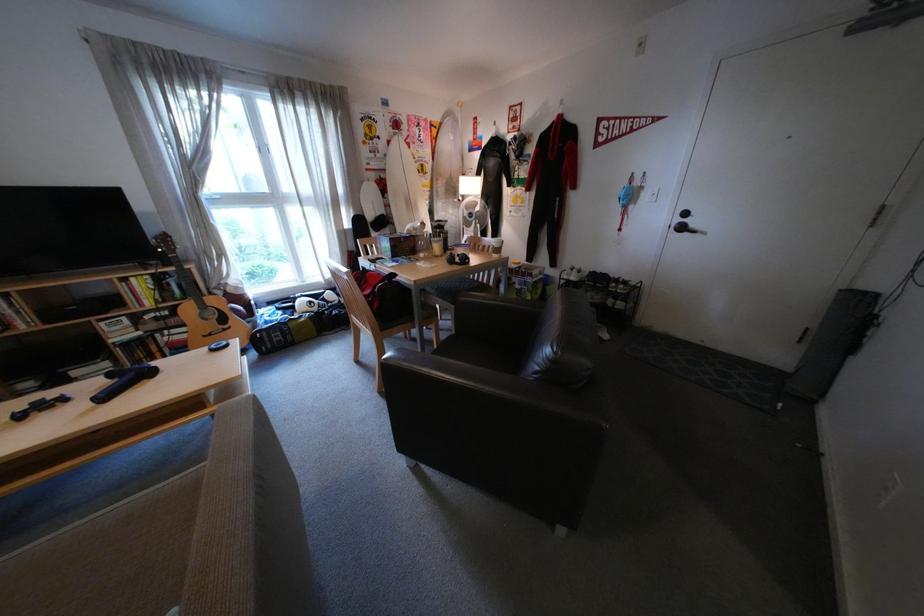
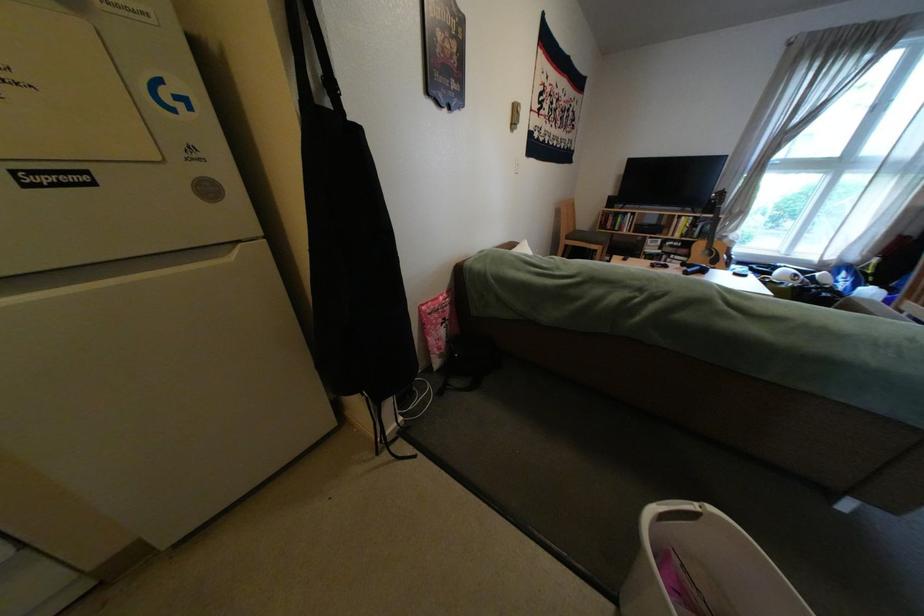
Locate, in the second image, the point that corresponds to the point at 184,336 in the first image.

(687, 260)